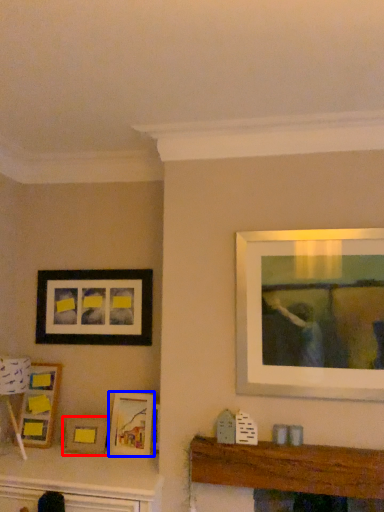
Question: Which point is further to the camera, picture frame (highlighted by a red box) or picture frame (highlighted by a blue box)?

Choices:
 (A) picture frame
 (B) picture frame

Answer: (A)